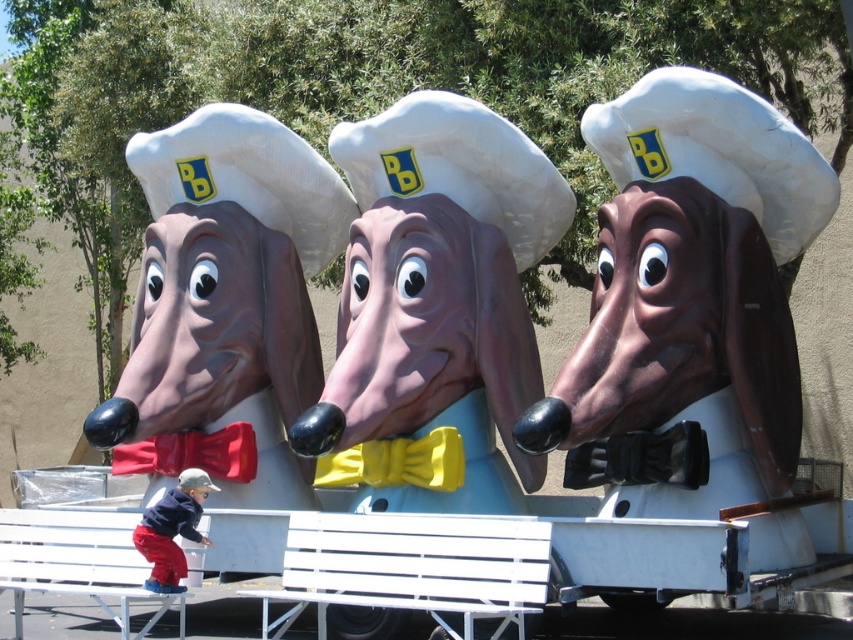
Question: Which of the following is the closest to the observer?

Choices:
 (A) coord(123,552)
 (B) coord(463,125)

Answer: (A)

Question: Is brown matte dog head at center positioned before white painted wood park bench at lower center?

Choices:
 (A) no
 (B) yes

Answer: (A)

Question: Which is nearer to the dark blue fleece jacket at lower left?

Choices:
 (A) yellow satin bow tie at lower center
 (B) yellow satin bow tie at center
 (C) brown matte dog head at center

Answer: (A)

Question: Is matte plastic sausage at center below dark blue fleece jacket at lower left?

Choices:
 (A) yes
 (B) no

Answer: (B)

Question: Based on their relative distances, which object is farther from the white plastic bench at lower left?

Choices:
 (A) yellow satin bow tie at center
 (B) white painted wood park bench at lower center
 (C) matte plastic sausage at center
 (D) dark blue fleece jacket at lower left

Answer: (C)

Question: Can you confirm if matte white statue at center is positioned above white plastic bench at lower left?

Choices:
 (A) no
 (B) yes

Answer: (B)